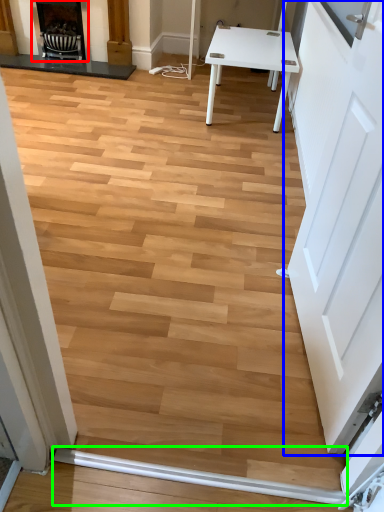
Question: Which object is the farthest from fireplace (highlighted by a red box)? Choose among these: door (highlighted by a blue box) or beam (highlighted by a green box).

Choices:
 (A) door
 (B) beam

Answer: (B)